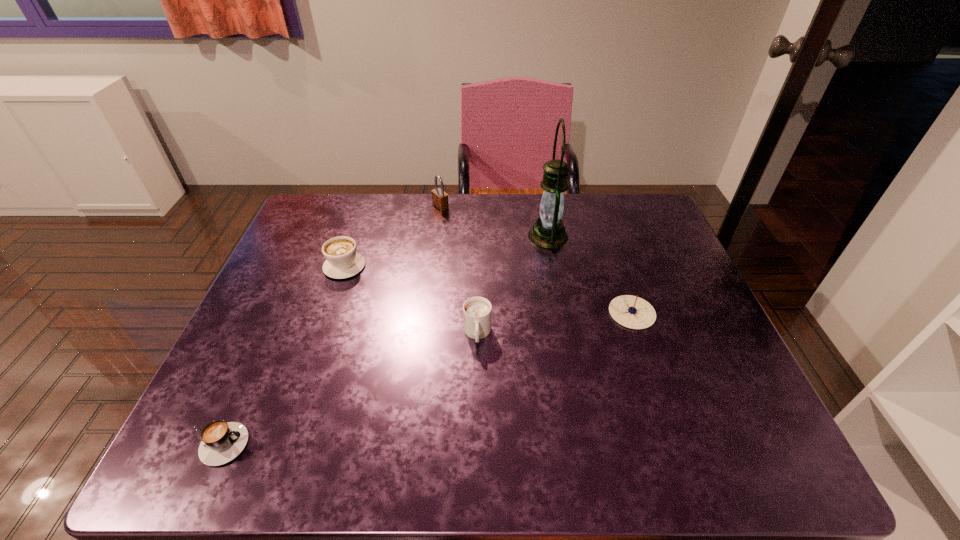
In order to click on the shortest cappuccino in this screenshot , I will do `click(221, 442)`.

Where is `the nearest cappuccino`? the nearest cappuccino is located at coordinates (221, 442).

Where is `free space located 0.090m on the side where the lantern emits light`? free space located 0.090m on the side where the lantern emits light is located at coordinates (498, 236).

Image resolution: width=960 pixels, height=540 pixels. I want to click on free space located 0.200m on the side where the lantern emits light, so click(461, 236).

This screenshot has height=540, width=960. I want to click on vacant space situated 0.120m on the side where the lantern emits light, so click(x=488, y=236).

Image resolution: width=960 pixels, height=540 pixels. Find the location of `free location located 0.390m on the left of the farthest object`. free location located 0.390m on the left of the farthest object is located at coordinates (312, 207).

The image size is (960, 540). What are the coordinates of `free space located 0.260m on the side with the handle of the second nearest cappuccino` in the screenshot? It's located at (477, 463).

This screenshot has width=960, height=540. Identify the location of free space located 0.130m to the right of the second object from left to right's handle. (358, 225).

This screenshot has height=540, width=960. What are the coordinates of `free space located to the right of the second object from left to right's handle` in the screenshot? It's located at (364, 208).

Where is `vacant space located to the right of the second object from left to right's handle`? vacant space located to the right of the second object from left to right's handle is located at coordinates (356, 231).